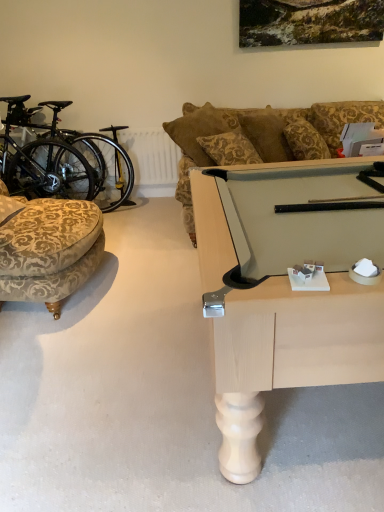
Question: From the image's perspective, would you say velvet-patterned ottoman at left is shown under black matte bicycle at left?

Choices:
 (A) yes
 (B) no

Answer: (A)

Question: Is velvet-patterned ottoman at left not inside black matte bicycle at left?

Choices:
 (A) yes
 (B) no

Answer: (A)

Question: Is black matte bicycle at left located within velvet-patterned ottoman at left?

Choices:
 (A) yes
 (B) no

Answer: (B)

Question: Can you confirm if velvet-patterned ottoman at left is wider than black matte bicycle at left?

Choices:
 (A) yes
 (B) no

Answer: (A)

Question: Is velvet-patterned ottoman at left taller than black matte bicycle at left?

Choices:
 (A) no
 (B) yes

Answer: (A)

Question: Can you confirm if velvet-patterned ottoman at left is bigger than black matte bicycle at left?

Choices:
 (A) yes
 (B) no

Answer: (B)

Question: Is black matte bicycle at left further to the viewer compared to velvet-patterned ottoman at left?

Choices:
 (A) yes
 (B) no

Answer: (A)

Question: Is black matte bicycle at left outside of velvet-patterned ottoman at left?

Choices:
 (A) yes
 (B) no

Answer: (A)

Question: From a real-world perspective, is black matte bicycle at left beneath velvet-patterned ottoman at left?

Choices:
 (A) no
 (B) yes

Answer: (A)

Question: Can you confirm if black matte bicycle at left is positioned to the left of velvet-patterned ottoman at left?

Choices:
 (A) yes
 (B) no

Answer: (A)

Question: Considering the relative positions of black matte bicycle at left and velvet-patterned ottoman at left in the image provided, is black matte bicycle at left in front of velvet-patterned ottoman at left?

Choices:
 (A) no
 (B) yes

Answer: (A)

Question: Is black matte bicycle at left shorter than velvet-patterned ottoman at left?

Choices:
 (A) yes
 (B) no

Answer: (B)

Question: Does point (84, 181) appear closer or farther from the camera than point (39, 280)?

Choices:
 (A) closer
 (B) farther

Answer: (B)